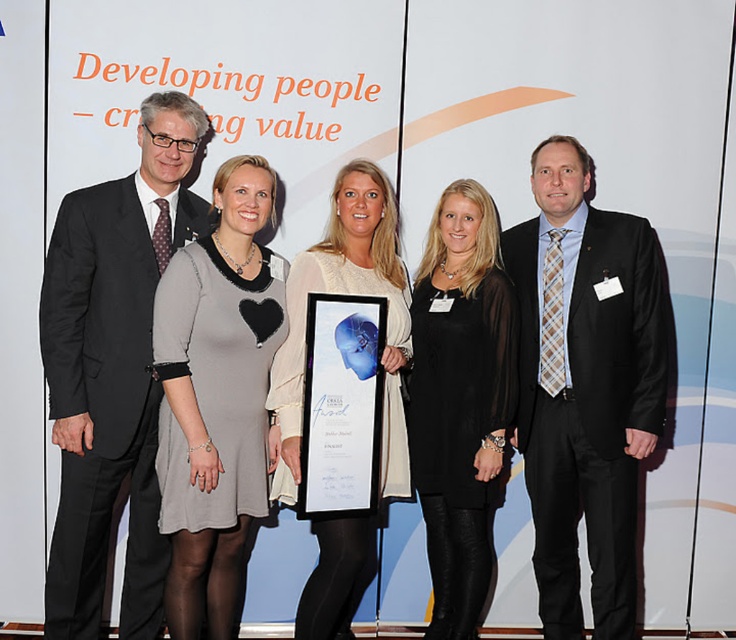
Who is positioned more to the left, black leather dress at center or blue glossy certificate at center?

blue glossy certificate at center is more to the left.

Does black leather dress at center have a greater width compared to blue glossy certificate at center?

Yes, black leather dress at center is wider than blue glossy certificate at center.

Which is in front, point (428, 529) or point (343, 440)?

Point (343, 440)

Locate an element on the screen. The height and width of the screenshot is (640, 736). black leather dress at center is located at coordinates (460, 400).

Is matte black suit at right shorter than gray matte dress at center?

No.

Which is in front, point (541, 326) or point (227, 356)?

Point (227, 356) is more forward.

The width and height of the screenshot is (736, 640). Find the location of `matte black suit at right`. matte black suit at right is located at coordinates (584, 385).

Does black suit at left lie in front of gray matte dress at center?

No, black suit at left is further to the viewer.

Measure the distance between black suit at left and camera.

The distance of black suit at left from camera is 8.86 feet.

Is point (45, 365) farther from camera compared to point (222, 449)?

Yes, point (45, 365) is farther from viewer.

This screenshot has height=640, width=736. What are the coordinates of `black suit at left` in the screenshot? It's located at click(113, 369).